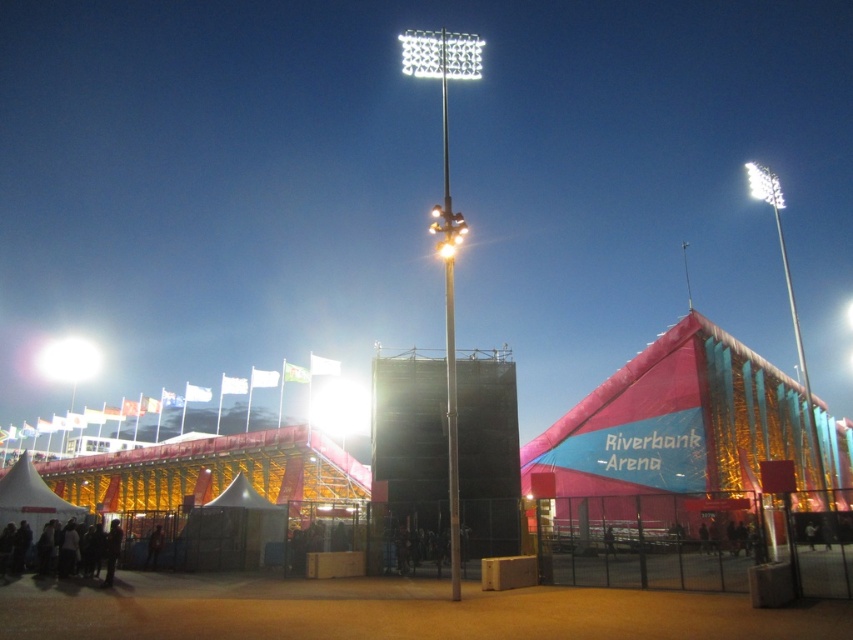
Question: Does metallic pole at center appear on the right side of white plastic floodlight at upper center?

Choices:
 (A) no
 (B) yes

Answer: (A)

Question: Which point is farther to the camera?

Choices:
 (A) (770, 195)
 (B) (450, 248)

Answer: (A)

Question: Which of these objects is positioned farthest from the white plastic light at upper right?

Choices:
 (A) white fabric tent at center
 (B) metallic pole at center

Answer: (A)

Question: Can you confirm if white textured floodlight at upper center is bigger than white canvas tent at lower left?

Choices:
 (A) yes
 (B) no

Answer: (A)

Question: Which of the following is the closest to the observer?

Choices:
 (A) white plastic light at upper right
 (B) white plastic floodlight at upper center
 (C) metallic pole at center

Answer: (C)

Question: Is bright white light at center bigger than bright white light at upper left?

Choices:
 (A) no
 (B) yes

Answer: (B)